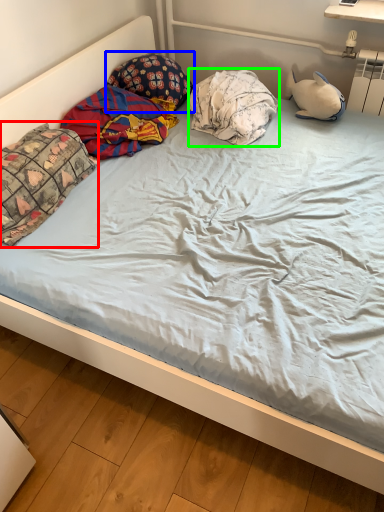
Question: Which is farther away from pillow (highlighted by a red box)? pillow (highlighted by a blue box) or pillow (highlighted by a green box)?

Choices:
 (A) pillow
 (B) pillow

Answer: (B)